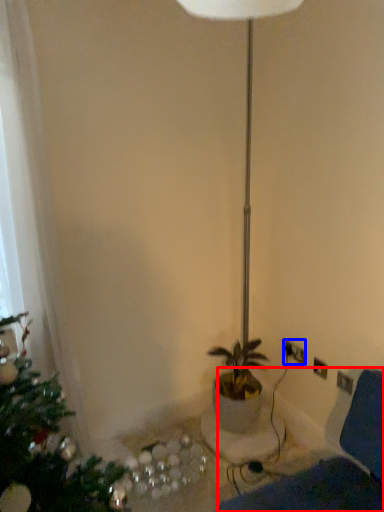
Question: Among these objects, which one is nearest to the camera, swivel chair (highlighted by a red box) or electric outlet (highlighted by a blue box)?

Choices:
 (A) swivel chair
 (B) electric outlet

Answer: (A)